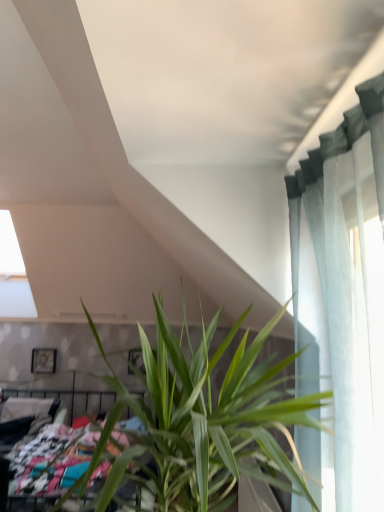
Question: Is multicolored fabric bed at lower left inside green leafy plant at center?

Choices:
 (A) no
 (B) yes

Answer: (A)

Question: Could you tell me if green leafy plant at center is turned towards multicolored fabric bed at lower left?

Choices:
 (A) no
 (B) yes

Answer: (A)

Question: From a real-world perspective, is green leafy plant at center beneath multicolored fabric bed at lower left?

Choices:
 (A) no
 (B) yes

Answer: (A)

Question: Does green leafy plant at center have a larger size compared to multicolored fabric bed at lower left?

Choices:
 (A) no
 (B) yes

Answer: (A)

Question: Can you confirm if green leafy plant at center is wider than multicolored fabric bed at lower left?

Choices:
 (A) yes
 (B) no

Answer: (B)

Question: From a real-world perspective, is green leafy plant at center physically above multicolored fabric bed at lower left?

Choices:
 (A) yes
 (B) no

Answer: (A)

Question: From the image's perspective, is green leafy plant at center over wooden picture frame at upper left?

Choices:
 (A) yes
 (B) no

Answer: (A)

Question: From the image's perspective, is green leafy plant at center located beneath wooden picture frame at upper left?

Choices:
 (A) yes
 (B) no

Answer: (B)

Question: Is wooden picture frame at upper left completely or partially inside green leafy plant at center?

Choices:
 (A) no
 (B) yes

Answer: (A)

Question: Could you tell me if green leafy plant at center is facing wooden picture frame at upper left?

Choices:
 (A) yes
 (B) no

Answer: (B)

Question: From a real-world perspective, is green leafy plant at center located higher than wooden picture frame at upper left?

Choices:
 (A) no
 (B) yes

Answer: (B)

Question: Are green leafy plant at center and wooden picture frame at upper left making contact?

Choices:
 (A) no
 (B) yes

Answer: (A)

Question: From a real-world perspective, is multicolored fabric bed at lower left beneath wooden picture frame at upper left?

Choices:
 (A) yes
 (B) no

Answer: (A)